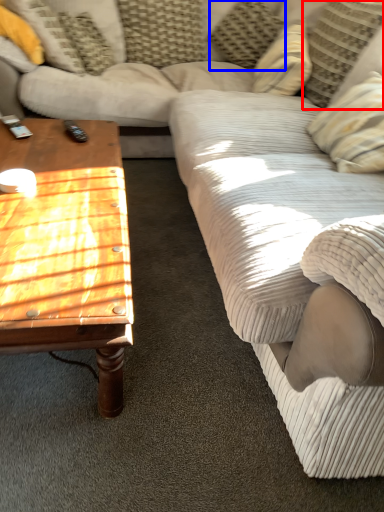
Question: Among these objects, which one is nearest to the camera, pillow (highlighted by a red box) or pillow (highlighted by a blue box)?

Choices:
 (A) pillow
 (B) pillow

Answer: (A)